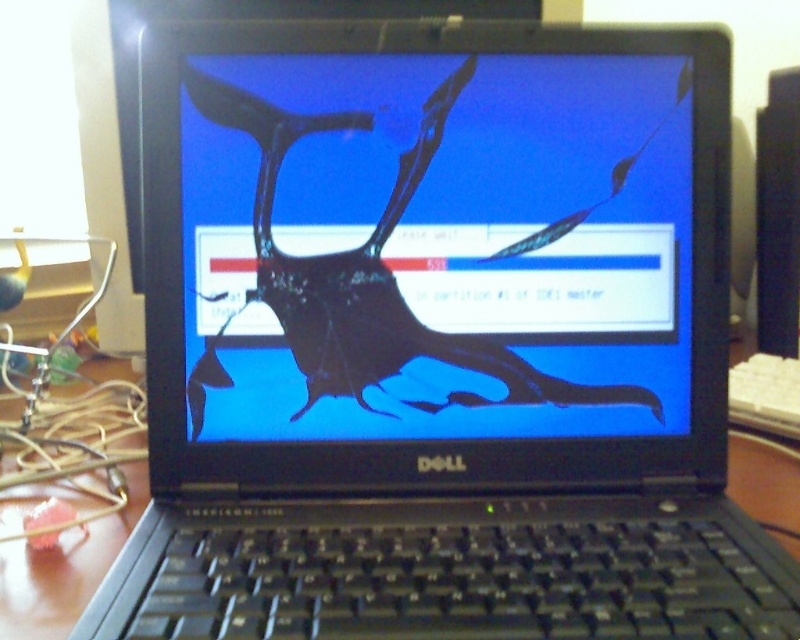
Can you confirm if transparent glass screen at center is wider than wooden table at center?

Yes, transparent glass screen at center is wider than wooden table at center.

Describe the element at coordinates (368, 269) in the screenshot. I see `transparent glass screen at center` at that location.

Where is `transparent glass screen at center`? The height and width of the screenshot is (640, 800). transparent glass screen at center is located at coordinates (368, 269).